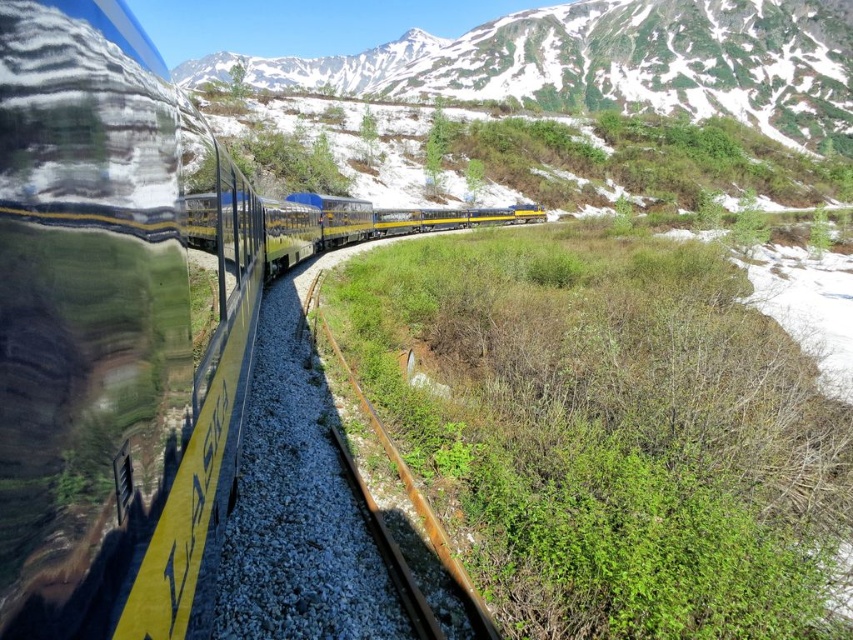
Does yellow polished metal train at left have a greater width compared to rusty metal train track at center?

Correct, the width of yellow polished metal train at left exceeds that of rusty metal train track at center.

You are a GUI agent. You are given a task and a screenshot of the screen. Output one action in this format:
    pyautogui.click(x=<x>, y=<y>)
    Task: Click on the yellow polished metal train at left
    The image size is (853, 640).
    Given the screenshot: What is the action you would take?
    pyautogui.click(x=114, y=324)

Who is more forward, [155,284] or [422,522]?

Point [155,284] is in front.

You are a GUI agent. You are given a task and a screenshot of the screen. Output one action in this format:
    pyautogui.click(x=<x>, y=<y>)
    Task: Click on the yellow polished metal train at left
    
    Given the screenshot: What is the action you would take?
    pyautogui.click(x=114, y=324)